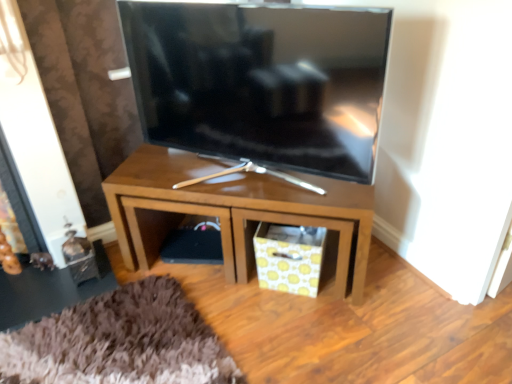
Question: Considering the positions of wooden tv stand at center and satin black tv at center in the image, is wooden tv stand at center taller or shorter than satin black tv at center?

Choices:
 (A) tall
 (B) short

Answer: (B)

Question: From the image's perspective, is wooden tv stand at center above or below satin black tv at center?

Choices:
 (A) above
 (B) below

Answer: (B)

Question: Considering the real-world distances, which object is farthest from the yellow patterned paper at lower center?

Choices:
 (A) wooden tv stand at center
 (B) shiny metallic side table at lower left
 (C) satin black tv at center

Answer: (B)

Question: Which of these objects is positioned farthest from the yellow patterned paper at lower center?

Choices:
 (A) satin black tv at center
 (B) wooden tv stand at center
 (C) shiny metallic side table at lower left

Answer: (C)